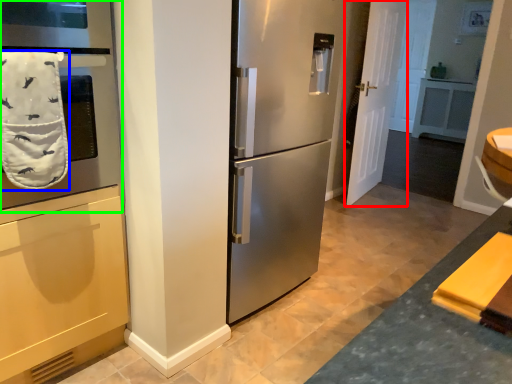
Question: Which object is positioned farthest from door (highlighted by a red box)? Select from bath towel (highlighted by a blue box) and oven (highlighted by a green box).

Choices:
 (A) bath towel
 (B) oven

Answer: (A)